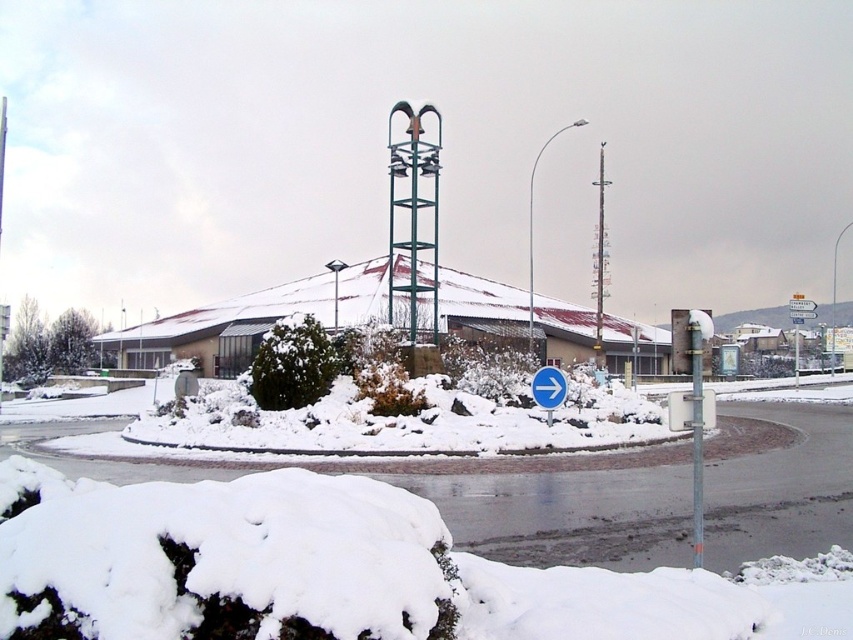
Question: From the image, what is the correct spatial relationship of green metal tower at center in relation to metallic pole at center?

Choices:
 (A) right
 (B) left

Answer: (B)

Question: Which object is the closest to the metallic pole at center?

Choices:
 (A) white plastic arrow at center
 (B) green metal tower at center

Answer: (A)

Question: Among these objects, which one is nearest to the camera?

Choices:
 (A) white plastic arrow at center
 (B) metallic pole at center

Answer: (B)

Question: Which point is closer to the camera taking this photo?

Choices:
 (A) (550, 387)
 (B) (437, 305)
 (C) (700, 372)

Answer: (C)

Question: Can you confirm if green metal tower at center is positioned to the left of white plastic arrow at center?

Choices:
 (A) no
 (B) yes

Answer: (B)

Question: Can you confirm if metallic pole at center is bigger than white plastic arrow at center?

Choices:
 (A) no
 (B) yes

Answer: (A)